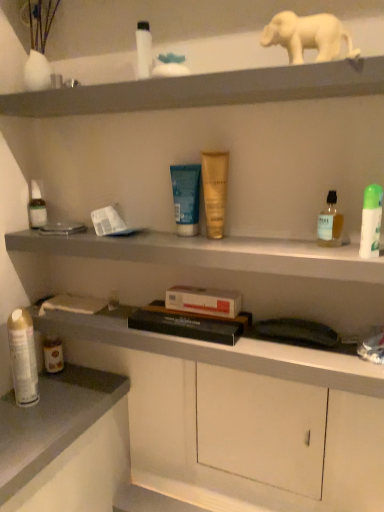
At what (x,y) coordinates should I click in order to perform the action: click on vacant area located to the right-hand side of gold matte tube at center, which appears as the 4th toiletry when viewed from the left. Please return your answer as a coordinate pair (x, y). The width and height of the screenshot is (384, 512). Looking at the image, I should click on (279, 242).